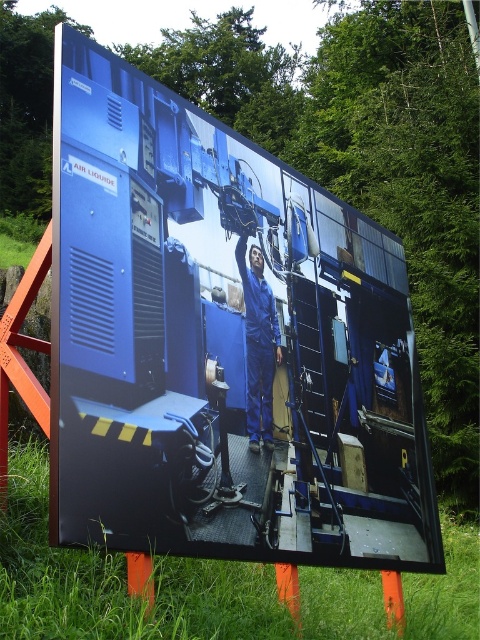
Can you confirm if green grass at lower left is positioned below blue smooth jumpsuit at center?

Yes, green grass at lower left is below blue smooth jumpsuit at center.

At what (x,y) coordinates should I click in order to perform the action: click on green grass at lower left. Please return your answer as a coordinate pair (x, y). Image resolution: width=480 pixels, height=640 pixels. Looking at the image, I should click on tap(117, 582).

Is blue metallic machinery at center smaller than green grass at lower left?

Yes.

Which is in front, point (419, 385) or point (419, 584)?

Point (419, 385)

Between point (126, 500) and point (3, 588), which one is positioned behind?

The point (126, 500) is behind.

Find the location of `blue metallic machinery at center`. blue metallic machinery at center is located at coordinates (220, 342).

Who is taller, blue metallic machinery at center or blue smooth jumpsuit at center?

blue smooth jumpsuit at center

Is point (280, 342) positioned in front of point (277, 360)?

No, (280, 342) is behind (277, 360).

Where is `blue metallic machinery at center`? Image resolution: width=480 pixels, height=640 pixels. blue metallic machinery at center is located at coordinates (220, 342).